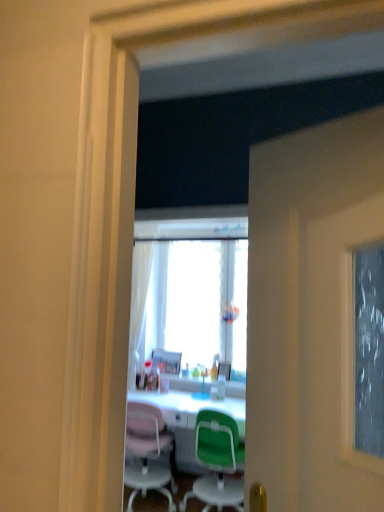
Question: Is metallic silver picture frame at center, marked as the 1th picture frame in a right-to-left arrangement, smaller than white glossy desk at center?

Choices:
 (A) no
 (B) yes

Answer: (B)

Question: Does metallic silver picture frame at center, which is the 2th picture frame in left-to-right order, lie behind white glossy desk at center?

Choices:
 (A) yes
 (B) no

Answer: (A)

Question: Does metallic silver picture frame at center, which is the 2th picture frame from back to front, appear on the left side of white glossy desk at center?

Choices:
 (A) no
 (B) yes

Answer: (A)

Question: Can you confirm if metallic silver picture frame at center, marked as the 1th picture frame in a right-to-left arrangement, is wider than white glossy desk at center?

Choices:
 (A) no
 (B) yes

Answer: (A)

Question: From the image's perspective, is metallic silver picture frame at center, the 1th picture frame when ordered from front to back, below white glossy desk at center?

Choices:
 (A) yes
 (B) no

Answer: (B)

Question: Considering the positions of metallic silver picture frame at center, marked as the 1th picture frame in a right-to-left arrangement, and matte plastic picture frame at center, the second picture frame viewed from the front, in the image, is metallic silver picture frame at center, marked as the 1th picture frame in a right-to-left arrangement, taller or shorter than matte plastic picture frame at center, the second picture frame viewed from the front,?

Choices:
 (A) tall
 (B) short

Answer: (B)

Question: Looking at the image, does metallic silver picture frame at center, marked as the 1th picture frame in a right-to-left arrangement, seem bigger or smaller compared to matte plastic picture frame at center, the 2th picture frame in the right-to-left sequence?

Choices:
 (A) big
 (B) small

Answer: (B)

Question: Is metallic silver picture frame at center, which is the 2th picture frame in left-to-right order, in front of or behind matte plastic picture frame at center, the 2th picture frame in the right-to-left sequence, in the image?

Choices:
 (A) front
 (B) behind

Answer: (A)

Question: From a real-world perspective, is metallic silver picture frame at center, which is the 2th picture frame in left-to-right order, positioned above or below matte plastic picture frame at center, the second picture frame viewed from the front?

Choices:
 (A) above
 (B) below

Answer: (B)

Question: From the image's perspective, is transparent glass window at center located above or below matte plastic picture frame at center, the second picture frame viewed from the front?

Choices:
 (A) above
 (B) below

Answer: (A)

Question: In terms of height, does transparent glass window at center look taller or shorter compared to matte plastic picture frame at center, the second picture frame viewed from the front?

Choices:
 (A) short
 (B) tall

Answer: (B)

Question: Looking at their shapes, would you say transparent glass window at center is wider or thinner than matte plastic picture frame at center, the second picture frame viewed from the front?

Choices:
 (A) thin
 (B) wide

Answer: (A)

Question: Choose the correct answer: Is transparent glass window at center inside matte plastic picture frame at center, the second picture frame viewed from the front, or outside it?

Choices:
 (A) outside
 (B) inside

Answer: (A)

Question: Is white glossy desk at center bigger or smaller than translucent plastic bottle at center?

Choices:
 (A) big
 (B) small

Answer: (A)

Question: From the image's perspective, is white glossy desk at center located above or below translucent plastic bottle at center?

Choices:
 (A) above
 (B) below

Answer: (B)